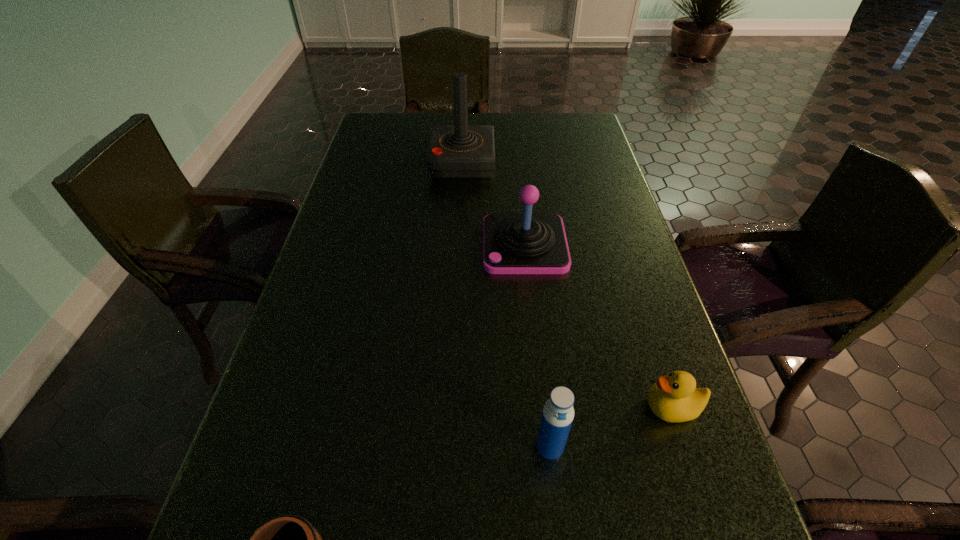
The width and height of the screenshot is (960, 540). Find the location of `vacant space situated forward from the base of the shorter joystick`. vacant space situated forward from the base of the shorter joystick is located at coordinates (450, 245).

Find the location of a particular element. This screenshot has width=960, height=540. vacant area located 0.170m on the back of the second nearest object is located at coordinates click(x=539, y=349).

You are a GUI agent. You are given a task and a screenshot of the screen. Output one action in this format:
    pyautogui.click(x=<x>, y=<y>)
    Task: Click on the free point located at the beak of the rightmost object
    
    Given the screenshot: What is the action you would take?
    [543, 408]

The width and height of the screenshot is (960, 540). I want to click on vacant space situated 0.080m at the beak of the rightmost object, so click(600, 408).

You are a GUI agent. You are given a task and a screenshot of the screen. Output one action in this format:
    pyautogui.click(x=<x>, y=<y>)
    Task: Click on the vacant space located at the beak of the rightmost object
    This screenshot has width=960, height=540.
    Given the screenshot: What is the action you would take?
    pyautogui.click(x=583, y=408)

The height and width of the screenshot is (540, 960). In order to click on object that is at the far edge in this screenshot , I will do `click(455, 151)`.

Locate an element on the screen. object that is at the right edge is located at coordinates (674, 398).

The image size is (960, 540). I want to click on vacant area at the left edge of the desktop, so click(273, 454).

Identify the location of vacant space at the right edge. Image resolution: width=960 pixels, height=540 pixels. (579, 188).

Find the location of a particular element. The width and height of the screenshot is (960, 540). vacant space at the far right corner of the desktop is located at coordinates (567, 137).